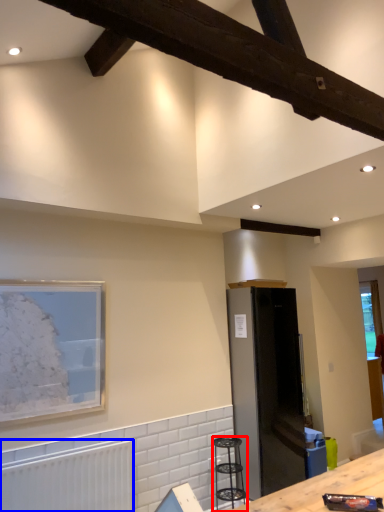
Question: Which point is further to the camera, bar stool (highlighted by a red box) or radiator (highlighted by a blue box)?

Choices:
 (A) bar stool
 (B) radiator

Answer: (A)